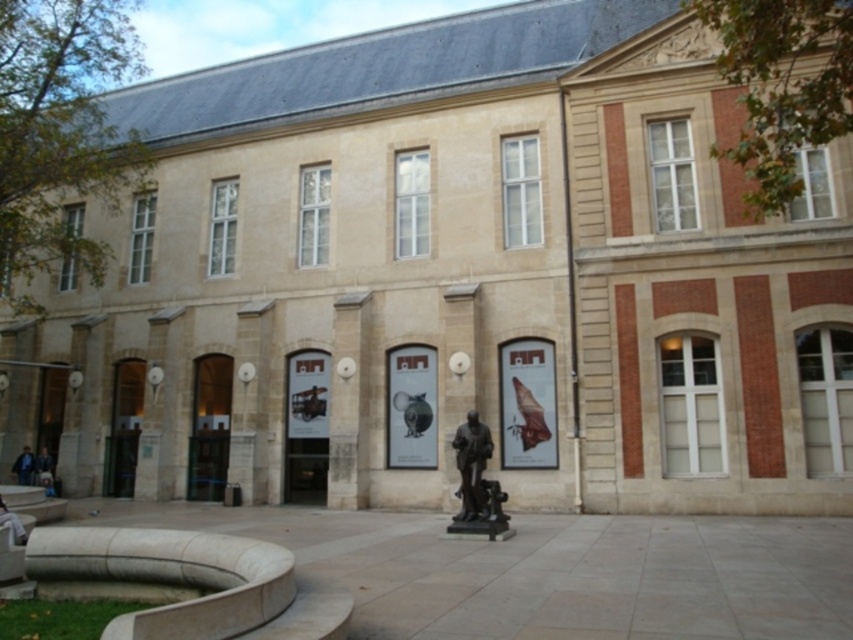
You are standing in the courtyard of the classical building and want to take a photo. There are two points marked in the scene, point 1 at coordinates point (32, 467) and point 2 at coordinates point (38, 460). Which point is closer to your current position?

Point (32, 467) is closer to the camera than point (38, 460), so point (32, 467) is closer to your current position.